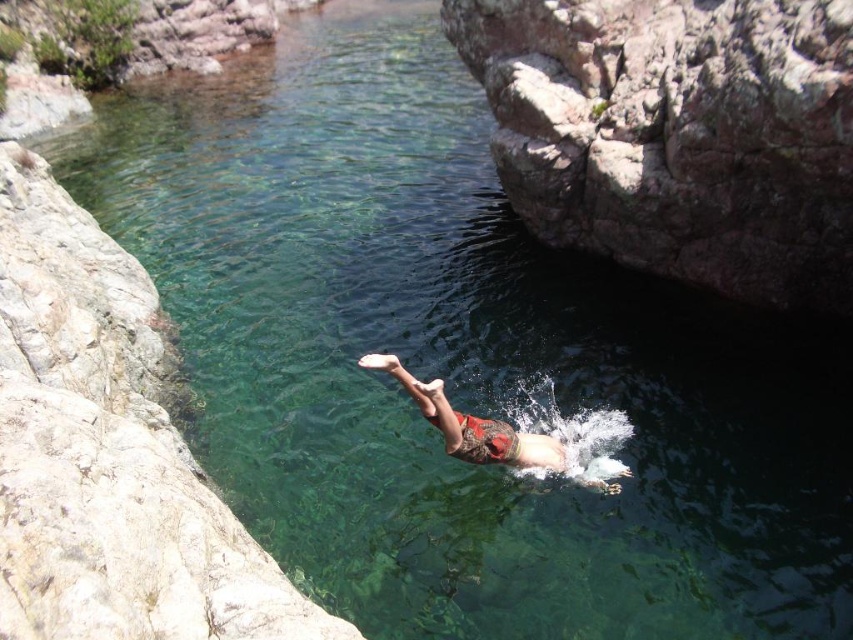
You are a diver preparing to jump into the water. You notice the rusty rock at upper right and the smooth gray rock at left. How far apart are these two rocks from each other?

The rusty rock at upper right and the smooth gray rock at left are 10.56 meters apart.